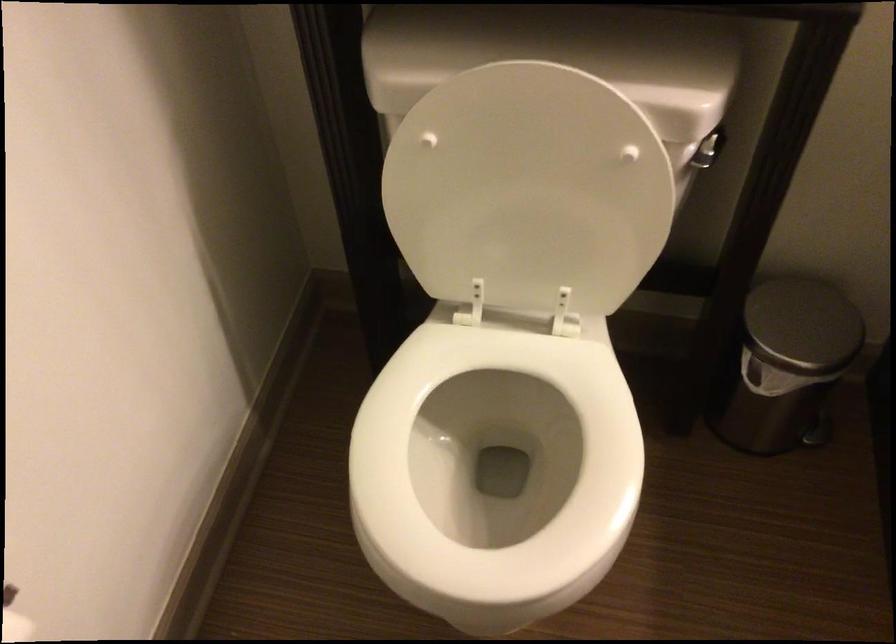
Find where to push the silver flush handle. Please return your answer as a coordinate pair (x, y).

(709, 149)